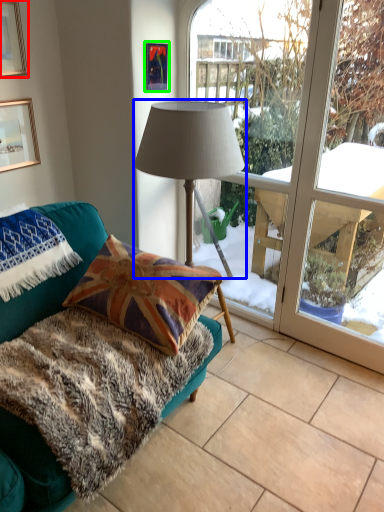
Question: Which object is the farthest from picture frame (highlighted by a red box)? Choose among these: lamp (highlighted by a blue box) or picture frame (highlighted by a green box).

Choices:
 (A) lamp
 (B) picture frame

Answer: (A)